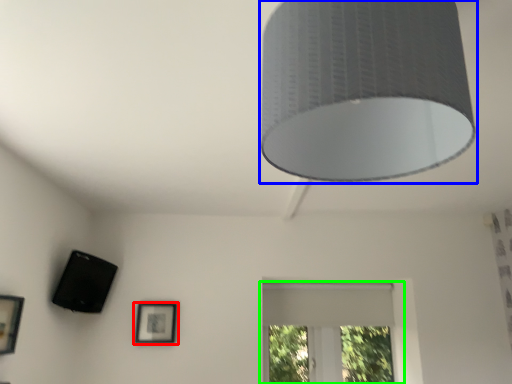
Question: Based on their relative distances, which object is nearer to picture frame (highlighted by a red box)? Choose from lamp (highlighted by a blue box) and window (highlighted by a green box).

Choices:
 (A) lamp
 (B) window

Answer: (B)